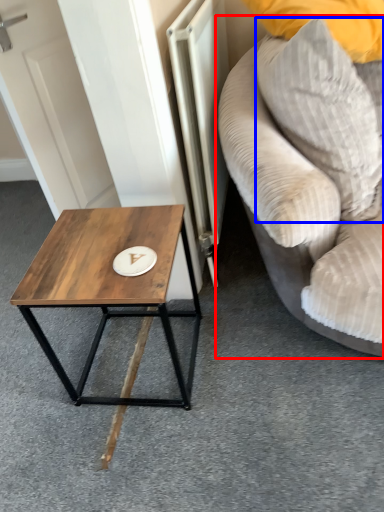
Question: Which object is further to the camera taking this photo, studio couch (highlighted by a red box) or pillow (highlighted by a blue box)?

Choices:
 (A) studio couch
 (B) pillow

Answer: (B)